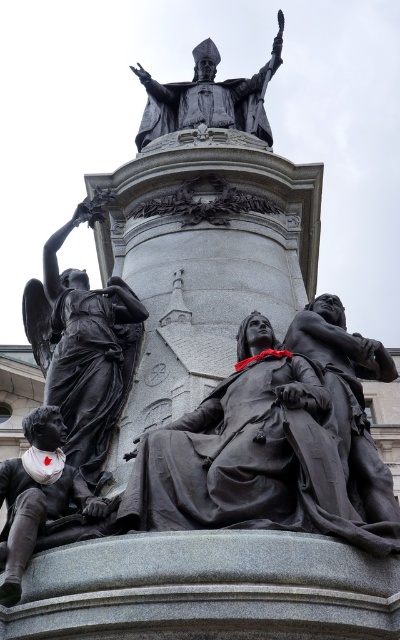
Question: Which point is farther to the camera?

Choices:
 (A) bronze statue at left
 (B) bronze statue at lower left

Answer: (A)

Question: Observing the image, what is the correct spatial positioning of matte black statue at center in reference to bronze statue at upper center?

Choices:
 (A) right
 (B) left

Answer: (A)

Question: Is bronze statue at left above bronze statue at upper center?

Choices:
 (A) yes
 (B) no

Answer: (B)

Question: Which is farther from the matte black statue at center?

Choices:
 (A) bronze statue at lower left
 (B) polished bronze statue at center

Answer: (A)

Question: Which point is closer to the camera?

Choices:
 (A) polished bronze statue at center
 (B) bronze statue at lower left
 (C) matte black statue at center

Answer: (B)

Question: From the image, what is the correct spatial relationship of bronze statue at lower left in relation to bronze statue at upper center?

Choices:
 (A) left
 (B) right

Answer: (A)